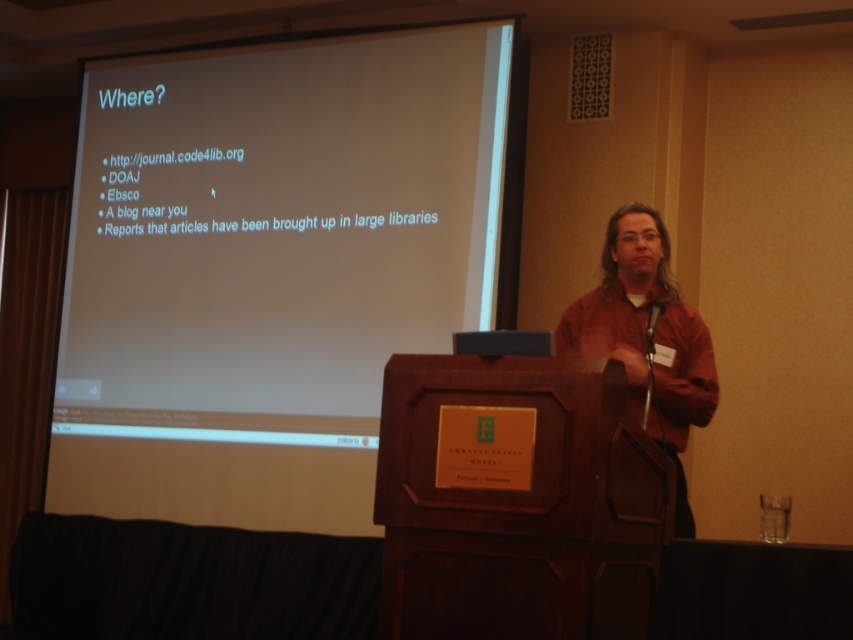
You are an event planner setting up a new presentation room. The existing white matte projection screen at upper left is placed at coordinates 0.420, 0.315. You want to place a new podium in the room such that it is centered relative to the screen. What coordinates should the podium be placed at to achieve this?

To center the podium relative to the white matte projection screen at upper left located at coordinates (x=268, y=268), the podium should be placed at the same x and y coordinates as the screen, which would be (x=268, y=268). This ensures alignment with the screen.

You are sitting in the front row of the presentation hall and want to look at both the white matte projection screen at upper left and the brown leather jacket at right. Which object will appear closer to you?

The white matte projection screen at upper left appears closer to you because it is further to the viewer than the brown leather jacket at right.

You are setting up for an event and need to place a 1.5 meter wide banner between the white matte projection screen at upper left and the dark wood podium at center. Based on the scene description, will the banner fit horizontally between them?

The white matte projection screen at upper left is wider than the dark wood podium at center. Since the banner is 1.5 meters wide, it depends on the actual width of the screen and podium. However, without specific measurements, we cannot confirm if the banner will fit horizontally between them.